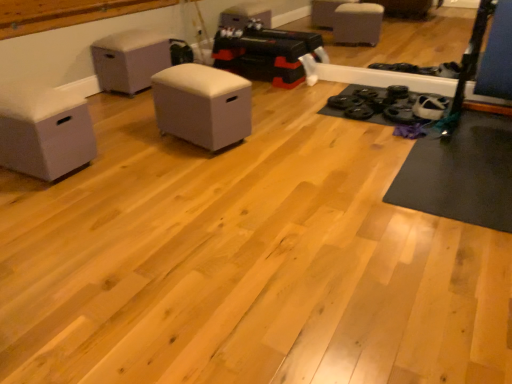
Question: Which direction should I rotate to look at white fabric ottoman at center, which is counted as the second furniture, starting from the back, — up or down?

Choices:
 (A) up
 (B) down

Answer: (A)

Question: Is white fabric ottoman at left, which ranks as the 1th furniture in front-to-back order, at the left side of white fabric ottoman at center, placed as the third furniture when sorted from left to right?

Choices:
 (A) no
 (B) yes

Answer: (B)

Question: Is white fabric ottoman at left, which is the third furniture in back-to-front order, facing towards white fabric ottoman at center, which is counted as the second furniture, starting from the back?

Choices:
 (A) no
 (B) yes

Answer: (A)

Question: From a real-world perspective, is white fabric ottoman at left, the third furniture viewed from the right, beneath white fabric ottoman at center, which is counted as the second furniture, starting from the back?

Choices:
 (A) no
 (B) yes

Answer: (A)

Question: From the image's perspective, would you say white fabric ottoman at left, the third furniture viewed from the right, is positioned over white fabric ottoman at center, placed as the third furniture when sorted from left to right?

Choices:
 (A) no
 (B) yes

Answer: (A)

Question: Would you say white fabric ottoman at center, placed as the third furniture when sorted from left to right, is part of white fabric ottoman at left, which is the third furniture in back-to-front order,'s contents?

Choices:
 (A) no
 (B) yes

Answer: (A)

Question: Considering the relative positions of white fabric ottoman at left, which is the third furniture in back-to-front order, and white fabric ottoman at center, which is counted as the second furniture, starting from the back, in the image provided, is white fabric ottoman at left, which is the third furniture in back-to-front order, to the right of white fabric ottoman at center, which is counted as the second furniture, starting from the back, from the viewer's perspective?

Choices:
 (A) yes
 (B) no

Answer: (B)

Question: From a real-world perspective, is white fabric ottoman at center, the second furniture positioned from the right, positioned over white fabric ottoman at left, the third furniture viewed from the right, based on gravity?

Choices:
 (A) no
 (B) yes

Answer: (B)

Question: Are white fabric ottoman at center, the second furniture positioned from the right, and white fabric ottoman at left, which is the first furniture from left to right, making contact?

Choices:
 (A) yes
 (B) no

Answer: (B)

Question: Are white fabric ottoman at center, positioned as the second furniture in left-to-right order, and white fabric ottoman at left, which ranks as the 1th furniture in front-to-back order, far apart?

Choices:
 (A) yes
 (B) no

Answer: (A)

Question: Can you confirm if white fabric ottoman at center, the second furniture positioned from the right, is positioned to the left of white fabric ottoman at left, the third furniture viewed from the right?

Choices:
 (A) yes
 (B) no

Answer: (B)

Question: Does white fabric ottoman at center, acting as the 1th furniture starting from the back, have a larger size compared to white fabric ottoman at left, the third furniture viewed from the right?

Choices:
 (A) yes
 (B) no

Answer: (A)

Question: From the image's perspective, is white fabric ottoman at center, acting as the 1th furniture starting from the back, beneath white fabric ottoman at left, which is the third furniture in back-to-front order?

Choices:
 (A) no
 (B) yes

Answer: (A)

Question: Does white fabric ottoman at center, which is counted as the first furniture, starting from the right, have a lesser height compared to white fabric ottoman at center, positioned as the 3th furniture in front-to-back order?

Choices:
 (A) yes
 (B) no

Answer: (A)